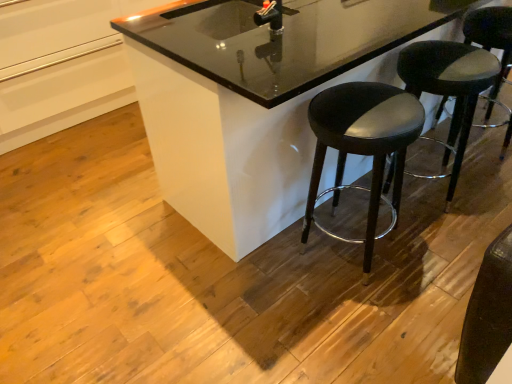
Locate an element on the screen. This screenshot has height=384, width=512. free space between black leather stool at lower right, which is the 2th stool in left-to-right order, and black leather stool at center, which is the 3th stool in right-to-left order is located at coordinates (385, 226).